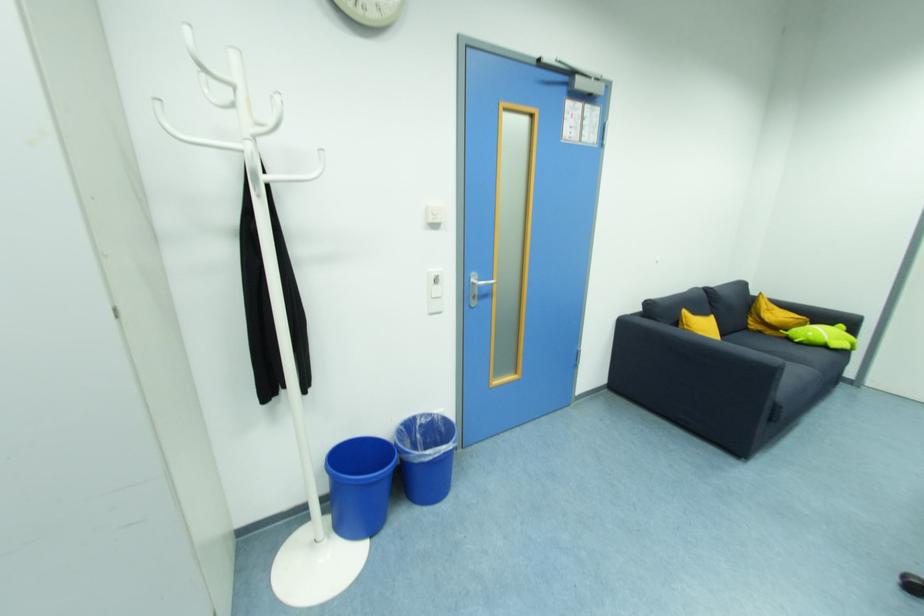
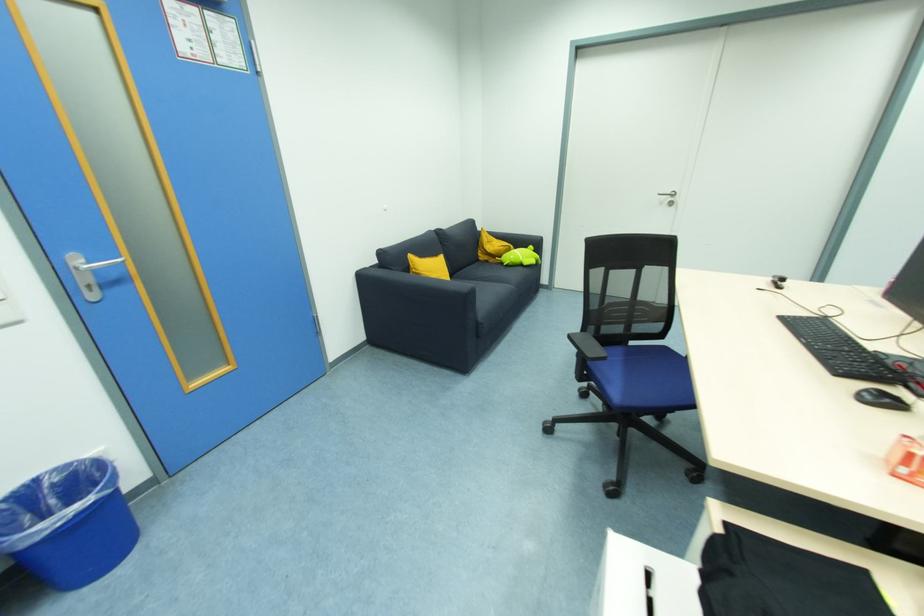
Question: The camera is either moving clockwise (left) or counter-clockwise (right) around the object. The first image is from the beginning of the video and the second image is from the end. Is the camera moving left or right when shooting the video?

Choices:
 (A) Left
 (B) Right

Answer: (A)